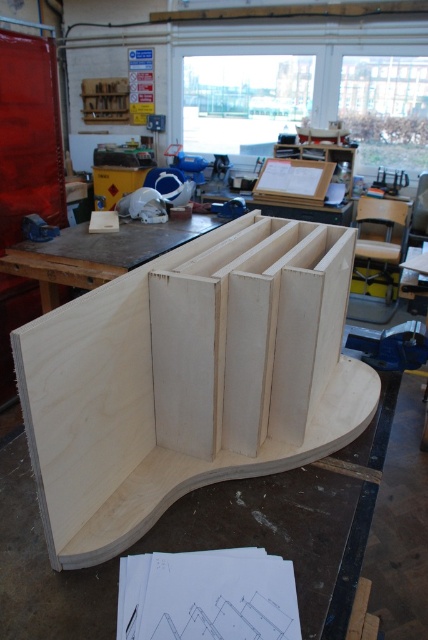
You are a carpenter trying to place the natural wood plywood at center onto the natural wood table at center. Based on their sizes, will the plywood fit entirely on the table without overhanging?

The natural wood plywood at center has a width less than the natural wood table at center, so yes, the plywood will fit entirely on the table without overhanging.

Consider the image. You are standing in the woodworking workshop and want to locate the natural wood plywood at center. According to the coordinates provided, where would you find it?

The natural wood plywood at center is located at the coordinates point (189, 380).